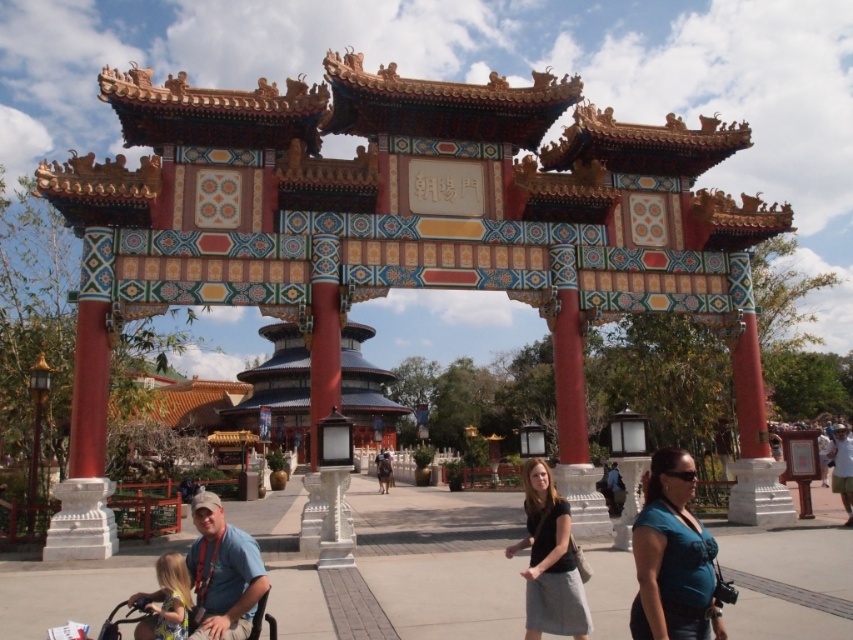
Question: Is teal fabric carrier at lower right positioned behind black cotton shirt at center?

Choices:
 (A) yes
 (B) no

Answer: (B)

Question: Which of the following is the closest to the observer?

Choices:
 (A) (846, 449)
 (B) (206, 538)
 (C) (381, 451)

Answer: (B)

Question: Is teal fabric carrier at lower right wider than dark blue shirt at center?

Choices:
 (A) yes
 (B) no

Answer: (A)

Question: Which of the following is the farthest from the observer?

Choices:
 (A) (564, 582)
 (B) (375, 461)

Answer: (B)

Question: Which object is the closest to the teal fabric carrier at lower right?

Choices:
 (A) light brown leather jacket at lower right
 (B) matte blue shirt at lower left
 (C) black cotton shirt at center
 (D) dark blue shirt at center

Answer: (C)

Question: Can you confirm if black cotton shirt at center is thinner than dark blue shirt at center?

Choices:
 (A) yes
 (B) no

Answer: (B)